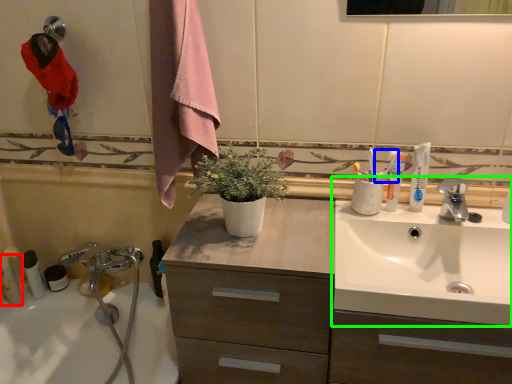
Question: Which is farther away from toiletry (highlighted by a red box)? toothpaste (highlighted by a blue box) or sink (highlighted by a green box)?

Choices:
 (A) toothpaste
 (B) sink

Answer: (B)